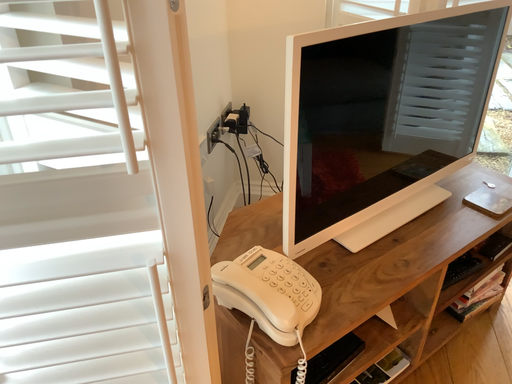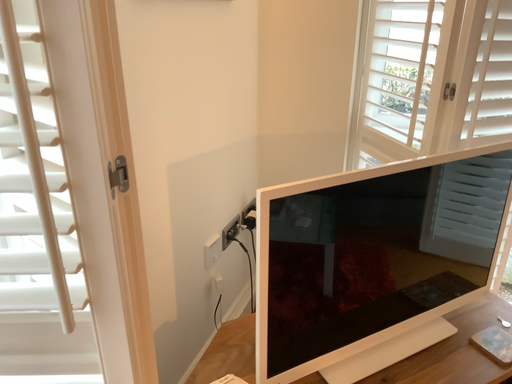
Question: How did the camera likely rotate when shooting the video?

Choices:
 (A) rotated downward
 (B) rotated upward

Answer: (B)